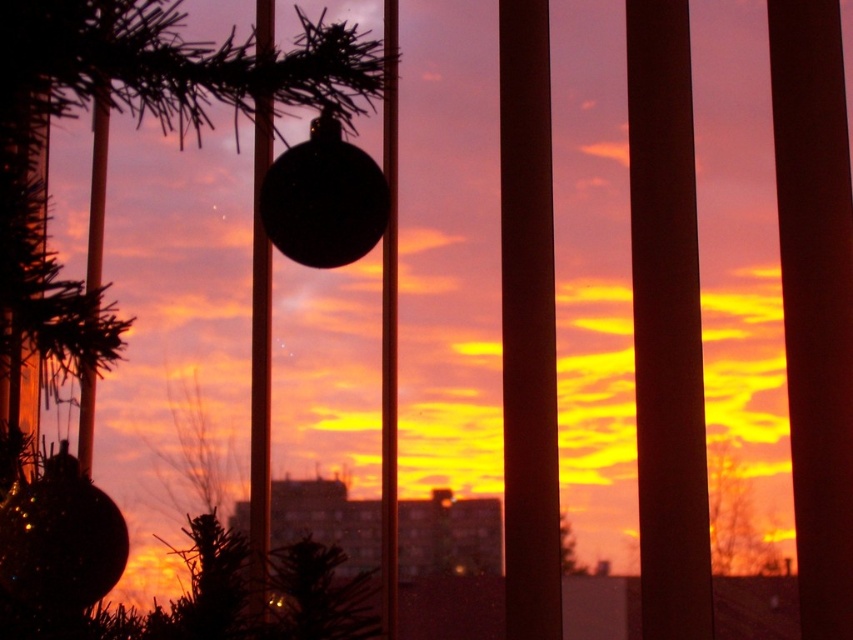
Question: Which point is closer to the camera?

Choices:
 (A) (53, 106)
 (B) (726, 497)

Answer: (A)

Question: From the image, what is the correct spatial relationship of shiny metallic ornament at upper center in relation to green matte tree at center?

Choices:
 (A) left
 (B) right

Answer: (A)

Question: Which point is closer to the camera?

Choices:
 (A) (750, 550)
 (B) (200, 116)

Answer: (B)

Question: Does shiny metallic ornament at upper center have a lesser width compared to green matte tree at center?

Choices:
 (A) yes
 (B) no

Answer: (B)

Question: Can you confirm if shiny metallic ornament at upper center is positioned to the right of green matte tree at center?

Choices:
 (A) yes
 (B) no

Answer: (B)